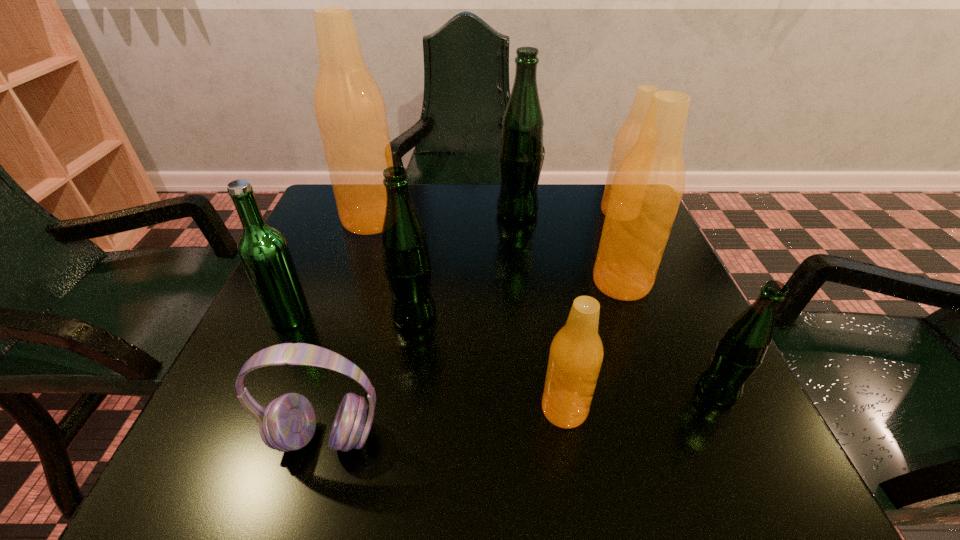
Locate which green beer bottle ranks in proximity to the sixth beer bottle from right to left. Please provide its 2D coordinates. Your answer should be formatted as a tuple, i.e. [(x, y)], where the tuple contains the x and y coordinates of a point satisfying the conditions above.

[(263, 250)]

Find the location of a particular element. vacant space that satisfies the following two spatial constraints: 1. on the back side of the biggest tan beer bottle; 2. on the right side of the second smallest tan beer bottle is located at coordinates (373, 212).